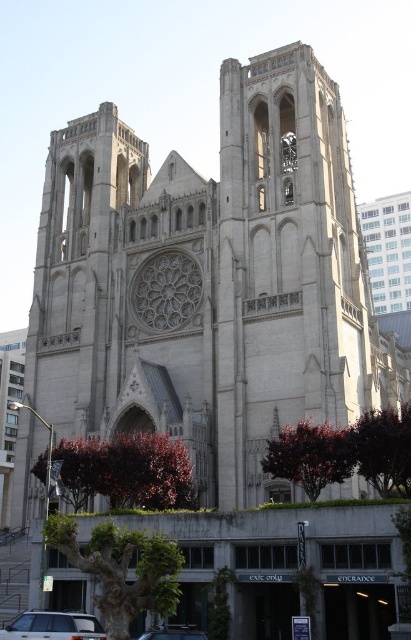
You are a visitor arriving at the cathedral and want to park your car. You see a silver metallic suv at lower left and a metallic silver car at center. Which vehicle should you avoid parking behind to ensure your car is visible from the cathedral entrance?

You should avoid parking behind the silver metallic suv at lower left because it is in front of the metallic silver car at center, meaning the suv would block the view of the car behind it from the cathedral entrance.

You are standing in front of the cathedral and want to determine the relative positions of two points marked on the ground. The first point is labeled as point [90,636] and the second is point [201,634]. Which point is closer to you?

Point [90,636] is closer to the viewer than point [201,634].